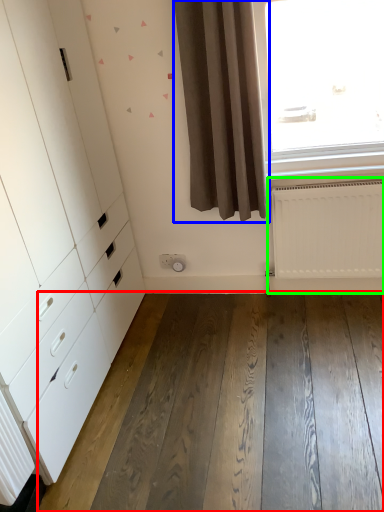
Question: Which object is the farthest from hardwood (highlighted by a red box)? Choose among these: curtain (highlighted by a blue box) or radiator (highlighted by a green box).

Choices:
 (A) curtain
 (B) radiator

Answer: (A)